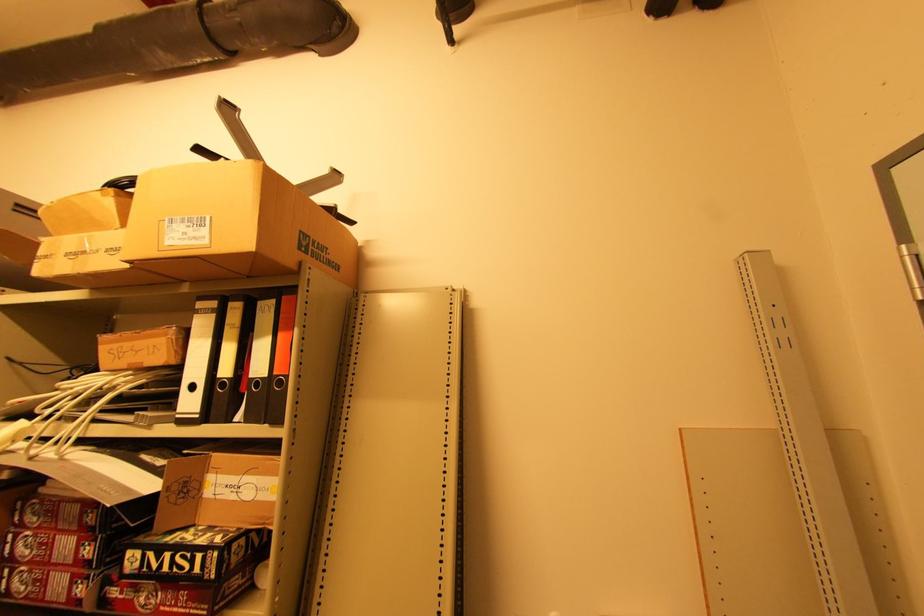
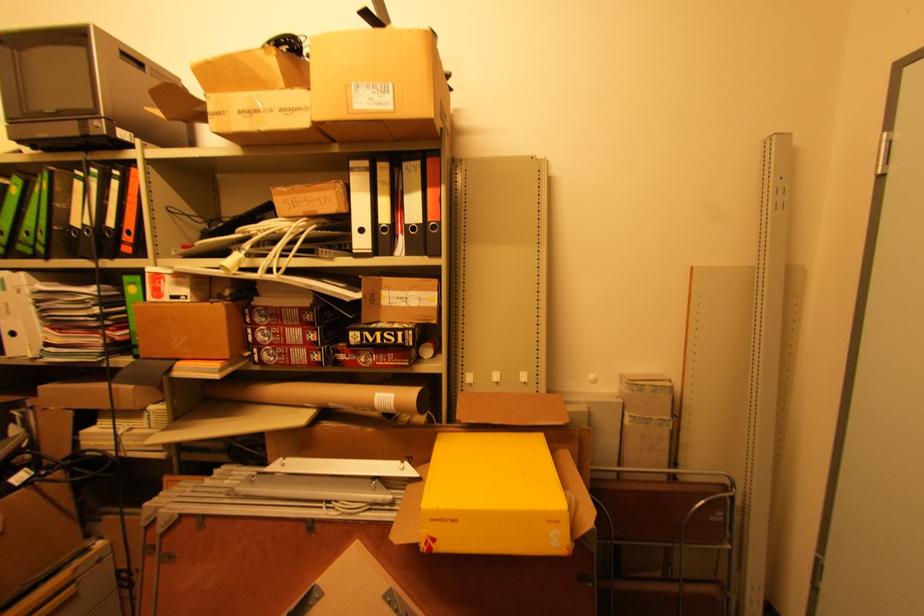
Find the pixel in the second image that matches the point at 196,493 in the first image.

(380, 302)